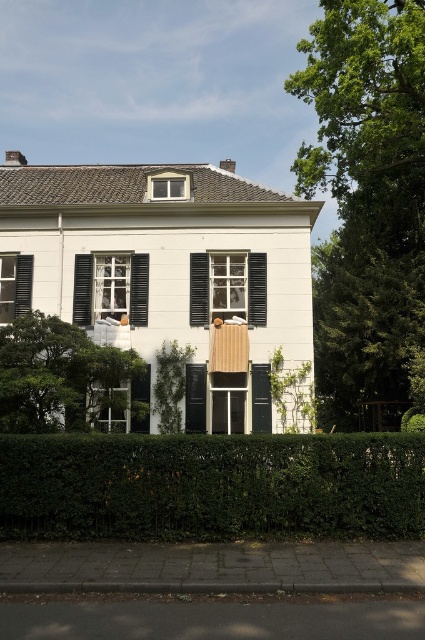
Question: Does green leafy bush at lower right appear over matte black shutters at left?

Choices:
 (A) no
 (B) yes

Answer: (A)

Question: Which object is positioned closest to the white wooden window at center?

Choices:
 (A) green leafy hedge at lower center
 (B) black matte door at center
 (C) matte black shutters at left
 (D) matte white window at upper center

Answer: (B)

Question: Considering the real-world distances, which object is closest to the matte white window at center?

Choices:
 (A) black matte door at center
 (B) matte white window at upper center
 (C) matte black shutters at left
 (D) green leafy tree at upper right

Answer: (C)

Question: Observing the image, what is the correct spatial positioning of green leafy hedge at lower center in reference to matte white window at center?

Choices:
 (A) right
 (B) left

Answer: (A)

Question: Is green leafy tree at upper right further to camera compared to green matte door at center?

Choices:
 (A) no
 (B) yes

Answer: (A)

Question: Among these objects, which one is nearest to the camera?

Choices:
 (A) green leafy tree at upper right
 (B) matte black shutters at left
 (C) green leafy hedge at lower center
 (D) green matte door at center

Answer: (C)